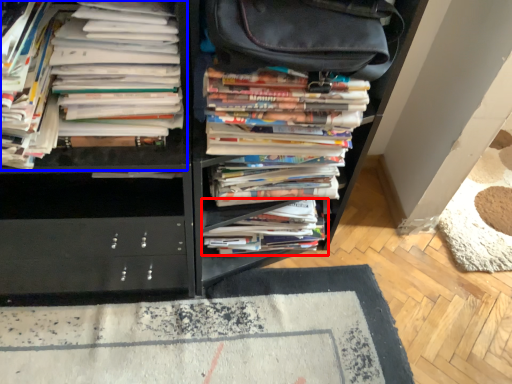
Question: Which point is closer to the camera, book (highlighted by a red box) or book (highlighted by a blue box)?

Choices:
 (A) book
 (B) book

Answer: (B)